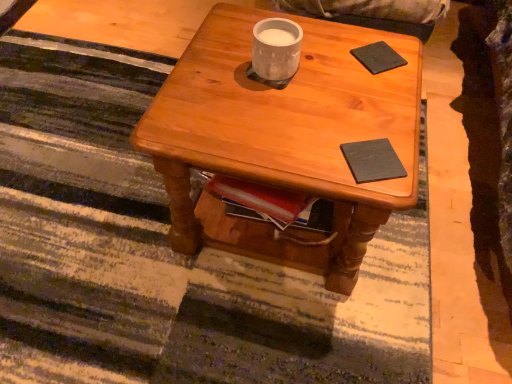
Question: Does white matte cup at center have a lesser height compared to black matte pad at upper right, which is the first pad in top-to-bottom order?

Choices:
 (A) yes
 (B) no

Answer: (B)

Question: Would you say white matte cup at center is outside black matte pad at upper right, the first pad viewed from the back?

Choices:
 (A) yes
 (B) no

Answer: (A)

Question: Is white matte cup at center facing towards black matte pad at upper right, which is the first pad in top-to-bottom order?

Choices:
 (A) no
 (B) yes

Answer: (A)

Question: Is white matte cup at center further to the viewer compared to black matte pad at upper right, placed as the second pad when sorted from bottom to top?

Choices:
 (A) no
 (B) yes

Answer: (A)

Question: From a real-world perspective, is white matte cup at center below black matte pad at upper right, the first pad viewed from the back?

Choices:
 (A) yes
 (B) no

Answer: (B)

Question: Considering the relative positions of white matte cup at center and black matte pad at upper right, the second pad in the front-to-back sequence, in the image provided, is white matte cup at center to the right of black matte pad at upper right, the second pad in the front-to-back sequence, from the viewer's perspective?

Choices:
 (A) yes
 (B) no

Answer: (B)

Question: Is dark matte book at center, which is the first pad from front to back, not near white matte cup at center?

Choices:
 (A) yes
 (B) no

Answer: (B)

Question: Considering the relative positions of dark matte book at center, positioned as the second pad in back-to-front order, and white matte cup at center in the image provided, is dark matte book at center, positioned as the second pad in back-to-front order, to the left of white matte cup at center from the viewer's perspective?

Choices:
 (A) yes
 (B) no

Answer: (B)

Question: Is dark matte book at center, which is the first pad from front to back, next to white matte cup at center and touching it?

Choices:
 (A) yes
 (B) no

Answer: (B)

Question: Does dark matte book at center, which is the first pad from front to back, appear on the right side of white matte cup at center?

Choices:
 (A) yes
 (B) no

Answer: (A)

Question: Is dark matte book at center, which is the first pad from front to back, further to the viewer compared to white matte cup at center?

Choices:
 (A) yes
 (B) no

Answer: (B)

Question: Is dark matte book at center, the second pad from the top, aimed at white matte cup at center?

Choices:
 (A) yes
 (B) no

Answer: (B)

Question: Does wooden coffee table at center have a smaller size compared to dark matte book at center, which is the first pad from front to back?

Choices:
 (A) yes
 (B) no

Answer: (B)